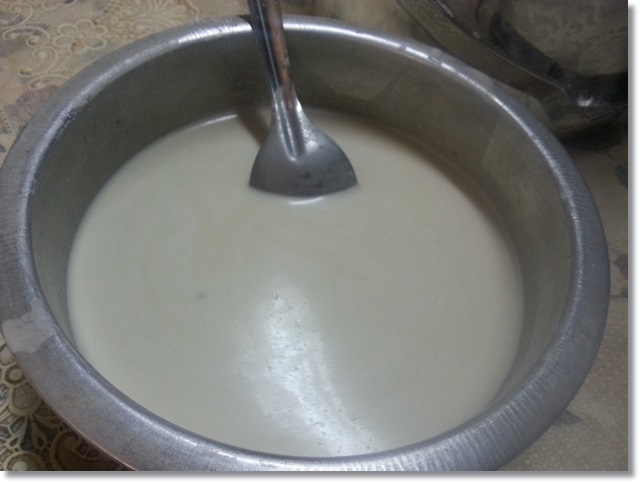
This screenshot has height=483, width=640. I want to click on top left corner table, so click(15, 56).